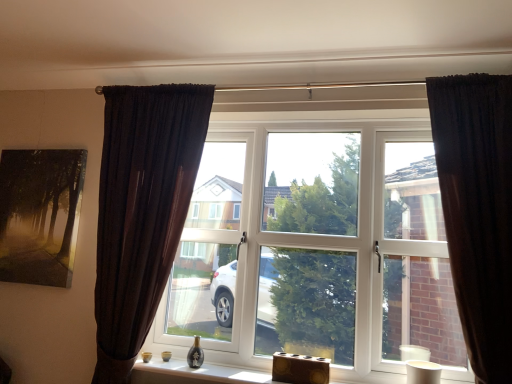
The height and width of the screenshot is (384, 512). Find the location of `vacant location behind wooden block at lower center`. vacant location behind wooden block at lower center is located at coordinates 294,379.